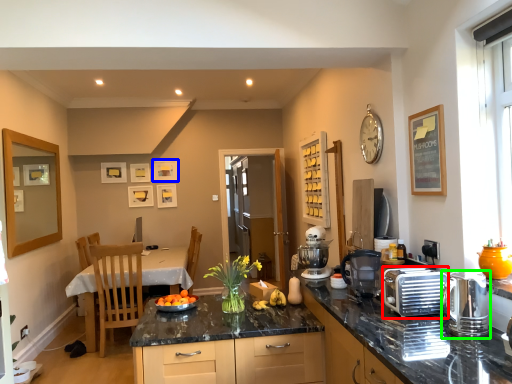
Question: Considering the real-world distances, which object is farthest from appliance (highlighted by a red box)? picture frame (highlighted by a blue box) or kitchen appliance (highlighted by a green box)?

Choices:
 (A) picture frame
 (B) kitchen appliance

Answer: (A)